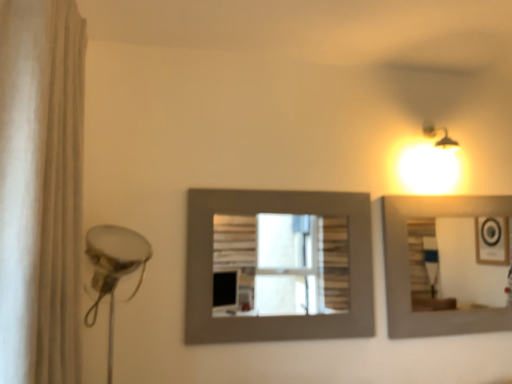
Question: Should I look upward or downward to see matte gray picture frame at center?

Choices:
 (A) down
 (B) up

Answer: (A)

Question: Is matte gray picture frame at center in front of white fabric shower curtain at left?

Choices:
 (A) no
 (B) yes

Answer: (A)

Question: Is matte gray picture frame at center aimed at white fabric shower curtain at left?

Choices:
 (A) yes
 (B) no

Answer: (A)

Question: From a real-world perspective, does matte gray picture frame at center sit lower than white fabric shower curtain at left?

Choices:
 (A) yes
 (B) no

Answer: (A)

Question: From the image's perspective, is matte gray picture frame at center located above white fabric shower curtain at left?

Choices:
 (A) yes
 (B) no

Answer: (B)

Question: Considering the relative positions of matte gray picture frame at center and white fabric shower curtain at left in the image provided, is matte gray picture frame at center to the left of white fabric shower curtain at left from the viewer's perspective?

Choices:
 (A) yes
 (B) no

Answer: (B)

Question: Is matte gray picture frame at center bigger than white fabric shower curtain at left?

Choices:
 (A) yes
 (B) no

Answer: (B)

Question: From a real-world perspective, is white fabric shower curtain at left beneath matte gray picture frame at center?

Choices:
 (A) no
 (B) yes

Answer: (A)

Question: From the image's perspective, is white fabric shower curtain at left below matte gray picture frame at center?

Choices:
 (A) yes
 (B) no

Answer: (B)

Question: From a real-world perspective, is white fabric shower curtain at left located higher than matte gray picture frame at center?

Choices:
 (A) yes
 (B) no

Answer: (A)

Question: Is white fabric shower curtain at left smaller than matte gray picture frame at center?

Choices:
 (A) no
 (B) yes

Answer: (A)

Question: Is white fabric shower curtain at left facing towards matte gray picture frame at center?

Choices:
 (A) no
 (B) yes

Answer: (A)

Question: Considering the relative positions of white fabric shower curtain at left and matte gray picture frame at center in the image provided, is white fabric shower curtain at left to the right of matte gray picture frame at center from the viewer's perspective?

Choices:
 (A) no
 (B) yes

Answer: (A)

Question: Visually, is white fabric shower curtain at left positioned to the left or to the right of matte gray picture frame at center?

Choices:
 (A) right
 (B) left

Answer: (B)